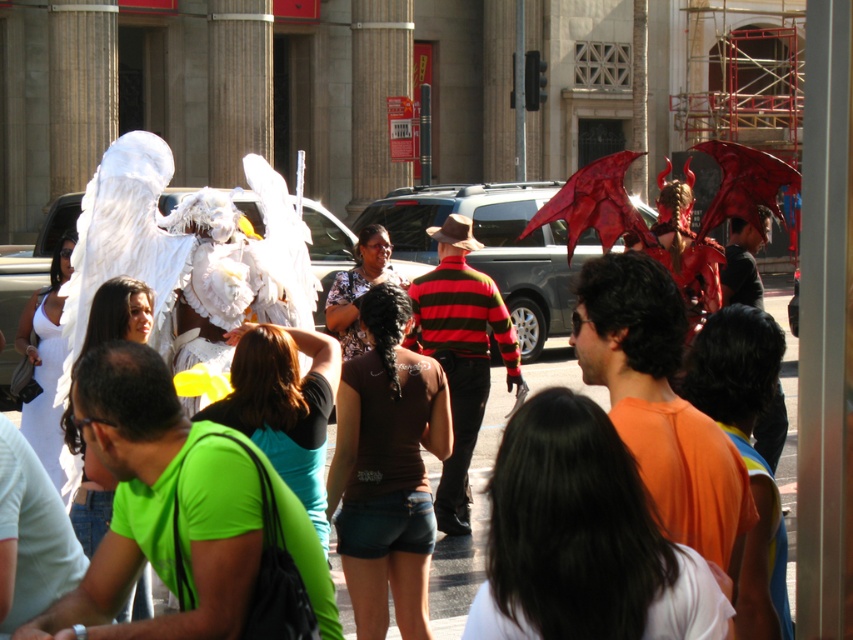
Question: Among these objects, which one is nearest to the camera?

Choices:
 (A) brown fabric shirt at center
 (B) white matte wings at upper left

Answer: (B)

Question: Does white matte wings at upper left appear on the left side of brown fabric shirt at center?

Choices:
 (A) no
 (B) yes

Answer: (A)

Question: Does white matte wings at upper left have a smaller size compared to brown fabric shirt at center?

Choices:
 (A) no
 (B) yes

Answer: (B)

Question: Which point is closer to the camera?

Choices:
 (A) (57, 356)
 (B) (656, 618)

Answer: (B)

Question: Is white satin dress at lower left positioned before brown fabric shirt at center?

Choices:
 (A) no
 (B) yes

Answer: (B)

Question: Which point is closer to the camera?

Choices:
 (A) white matte wings at upper left
 (B) brown fabric shirt at center
 (C) white satin dress at lower left

Answer: (A)